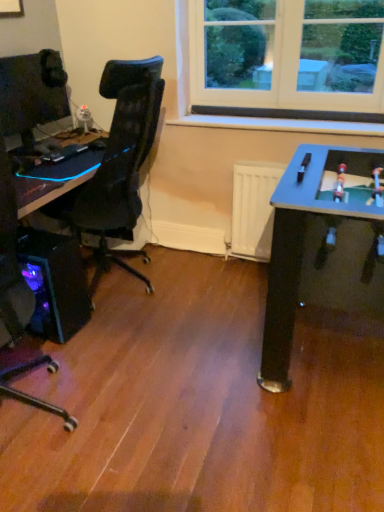
Question: Considering the relative sizes of matte black monitor at left and black plastic desk at left in the image provided, is matte black monitor at left wider than black plastic desk at left?

Choices:
 (A) yes
 (B) no

Answer: (B)

Question: Does matte black monitor at left have a greater height compared to black plastic desk at left?

Choices:
 (A) no
 (B) yes

Answer: (B)

Question: Is matte black monitor at left touching black plastic desk at left?

Choices:
 (A) no
 (B) yes

Answer: (A)

Question: From the image's perspective, is matte black monitor at left below black plastic desk at left?

Choices:
 (A) yes
 (B) no

Answer: (B)

Question: Does matte black monitor at left have a smaller size compared to black plastic desk at left?

Choices:
 (A) no
 (B) yes

Answer: (B)

Question: Relative to matte black monitor at left, is black plastic desk at left in front or behind?

Choices:
 (A) front
 (B) behind

Answer: (A)

Question: From a real-world perspective, is black plastic desk at left above or below matte black monitor at left?

Choices:
 (A) above
 (B) below

Answer: (B)

Question: In the image, is black plastic desk at left on the left side or the right side of matte black monitor at left?

Choices:
 (A) left
 (B) right

Answer: (B)

Question: Considering the positions of black plastic desk at left and matte black monitor at left in the image, is black plastic desk at left bigger or smaller than matte black monitor at left?

Choices:
 (A) small
 (B) big

Answer: (B)

Question: Is point (23, 84) closer or farther from the camera than point (66, 316)?

Choices:
 (A) closer
 (B) farther

Answer: (B)

Question: Is matte black monitor at left bigger or smaller than translucent purple plastic computer tower at lower left?

Choices:
 (A) big
 (B) small

Answer: (B)

Question: Relative to translucent purple plastic computer tower at lower left, is matte black monitor at left in front or behind?

Choices:
 (A) front
 (B) behind

Answer: (B)

Question: Considering the relative positions of matte black monitor at left and translucent purple plastic computer tower at lower left in the image provided, is matte black monitor at left to the left or to the right of translucent purple plastic computer tower at lower left?

Choices:
 (A) left
 (B) right

Answer: (A)

Question: Considering the positions of white plastic toy at upper center and matte black monitor at left in the image, is white plastic toy at upper center taller or shorter than matte black monitor at left?

Choices:
 (A) short
 (B) tall

Answer: (A)

Question: Based on their positions, is white plastic toy at upper center located to the left or right of matte black monitor at left?

Choices:
 (A) right
 (B) left

Answer: (A)